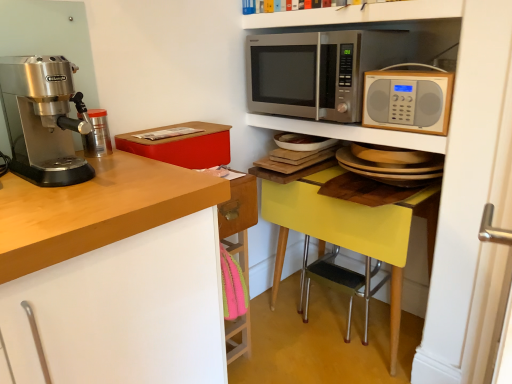
Question: Is matte red box at upper left not inside white glossy shelf at upper center, acting as the first shelf starting from the top?

Choices:
 (A) no
 (B) yes

Answer: (B)

Question: Is matte red box at upper left shorter than white glossy shelf at upper center, acting as the first shelf starting from the top?

Choices:
 (A) yes
 (B) no

Answer: (B)

Question: Considering the relative sizes of matte red box at upper left and white glossy shelf at upper center, acting as the first shelf starting from the top, in the image provided, is matte red box at upper left thinner than white glossy shelf at upper center, acting as the first shelf starting from the top,?

Choices:
 (A) no
 (B) yes

Answer: (B)

Question: Can you confirm if matte red box at upper left is wider than white glossy shelf at upper center, acting as the first shelf starting from the top?

Choices:
 (A) yes
 (B) no

Answer: (B)

Question: Can you confirm if matte red box at upper left is taller than white glossy shelf at upper center, acting as the first shelf starting from the top?

Choices:
 (A) no
 (B) yes

Answer: (B)

Question: From the image's perspective, is polished stainless steel espresso machine at left above or below stainless steel microwave at upper center, arranged as the 2th microwave oven when viewed from the front?

Choices:
 (A) below
 (B) above

Answer: (A)

Question: Looking at their shapes, would you say polished stainless steel espresso machine at left is wider or thinner than stainless steel microwave at upper center, the first microwave oven from the back?

Choices:
 (A) thin
 (B) wide

Answer: (A)

Question: Is polished stainless steel espresso machine at left in front of or behind stainless steel microwave at upper center, the first microwave oven from the back, in the image?

Choices:
 (A) behind
 (B) front

Answer: (B)

Question: In terms of size, does polished stainless steel espresso machine at left appear bigger or smaller than stainless steel microwave at upper center, the first microwave oven from the back?

Choices:
 (A) big
 (B) small

Answer: (B)

Question: From the image's perspective, is stainless steel microwave at upper center, the first microwave oven from the back, above or below metallic silver canister at left?

Choices:
 (A) below
 (B) above

Answer: (B)

Question: Is stainless steel microwave at upper center, the first microwave oven from the back, inside or outside of metallic silver canister at left?

Choices:
 (A) inside
 (B) outside

Answer: (B)

Question: Does point (246, 89) appear closer or farther from the camera than point (90, 137)?

Choices:
 (A) closer
 (B) farther

Answer: (A)

Question: In terms of width, does stainless steel microwave at upper center, arranged as the 2th microwave oven when viewed from the front, look wider or thinner when compared to metallic silver canister at left?

Choices:
 (A) thin
 (B) wide

Answer: (B)

Question: From their relative heights in the image, would you say metallic silver microwave at upper center, the second shelf when ordered from top to bottom, is taller or shorter than matte red box at upper left?

Choices:
 (A) short
 (B) tall

Answer: (A)

Question: From the image's perspective, is metallic silver microwave at upper center, the first shelf from the bottom, positioned above or below matte red box at upper left?

Choices:
 (A) below
 (B) above

Answer: (B)